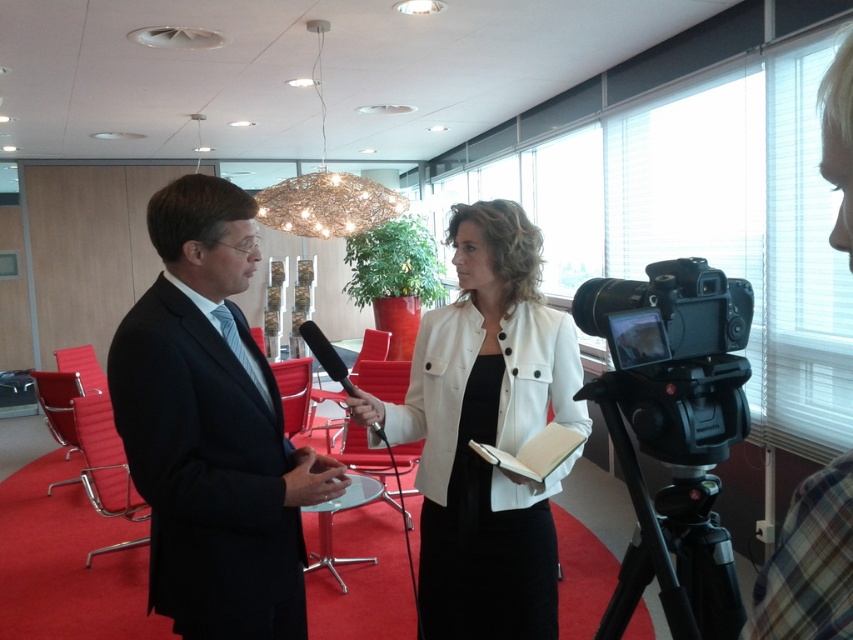
Question: Is white matte jacket at center below black matte microphone at center?

Choices:
 (A) no
 (B) yes

Answer: (B)

Question: Which is farther from the white matte jacket at upper center?

Choices:
 (A) dark blue suit at center
 (B) white matte jacket at center
 (C) black matte microphone at center

Answer: (C)

Question: Among these points, which one is farthest from the camera?

Choices:
 (A) (119, 339)
 (B) (347, 387)

Answer: (B)

Question: Does dark blue suit at center have a smaller size compared to black matte tripod at lower right?

Choices:
 (A) no
 (B) yes

Answer: (A)

Question: Which of the following is the farthest from the observer?

Choices:
 (A) white matte jacket at center
 (B) black plastic video camera at right
 (C) dark blue suit at center

Answer: (A)

Question: Is dark blue suit at center above white matte jacket at center?

Choices:
 (A) no
 (B) yes

Answer: (A)